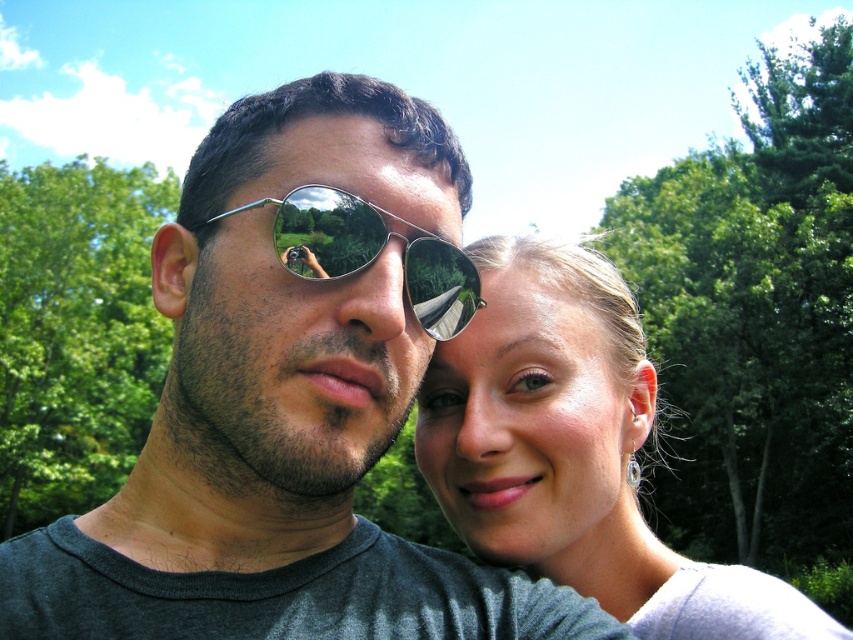
You are analyzing a photo of two people in a forest. You notice two points in the image with coordinates point (234, 488) and point (503, 483). Based on their positions, which point is nearer to you?

Point (234, 488) is closer to the viewer than point (503, 483).

You are a photographer trying to capture a wide shot of the scene. The matte black sunglasses at center and the green leafy tree at left are both in the frame. Based on their sizes, which object would appear smaller in the photo?

The matte black sunglasses at center has a lesser width compared to the green leafy tree at left, so it would appear smaller in the photo.

You are a photographer trying to capture the best shot of the two people in the image. The smooth skin face at right and the green leafy tree at left are both in your frame. Based on their positions, which object is positioned lower in the image?

The smooth skin face at right is located below green leafy tree at left, so the smooth skin face at right is positioned lower in the image.